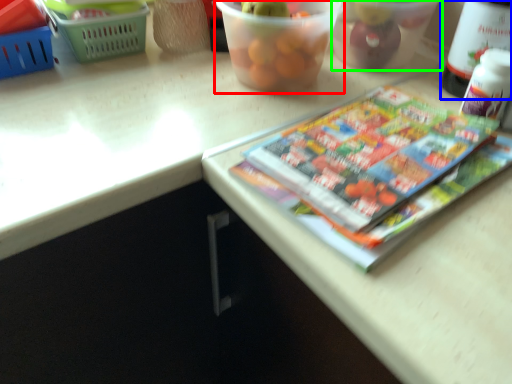
Question: Which object is positioned farthest from glass bowl (highlighted by a red box)? Select from wine bottle (highlighted by a blue box) and glass bowl (highlighted by a green box).

Choices:
 (A) wine bottle
 (B) glass bowl

Answer: (A)